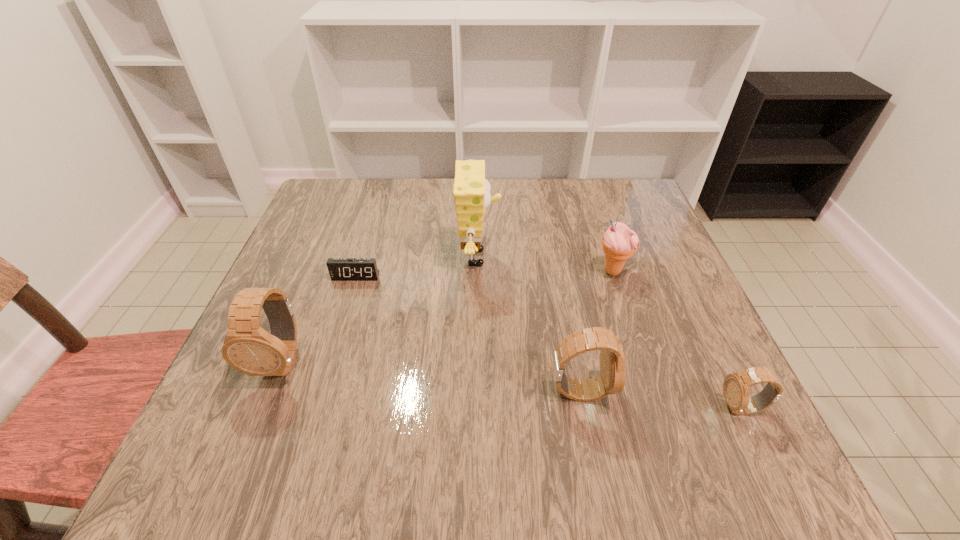
Where is `the second closest watch to the rightmost watch`? Image resolution: width=960 pixels, height=540 pixels. the second closest watch to the rightmost watch is located at coordinates (247, 347).

This screenshot has height=540, width=960. I want to click on the third closest watch relative to the icecream, so click(x=247, y=347).

This screenshot has width=960, height=540. In order to click on vacant area in the image that satisfies the following two spatial constraints: 1. on the front-facing side of the sponge; 2. on the face of the leftmost watch in this screenshot , I will do `click(478, 361)`.

This screenshot has width=960, height=540. Identify the location of vacant position in the image that satisfies the following two spatial constraints: 1. on the front-facing side of the fourth object from right to left; 2. on the face of the leftmost watch. (478, 361).

At what (x,y) coordinates should I click in order to perform the action: click on vacant space that satisfies the following two spatial constraints: 1. on the front-facing side of the tallest object; 2. on the face of the leftmost watch. Please return your answer as a coordinate pair (x, y). Looking at the image, I should click on (478, 361).